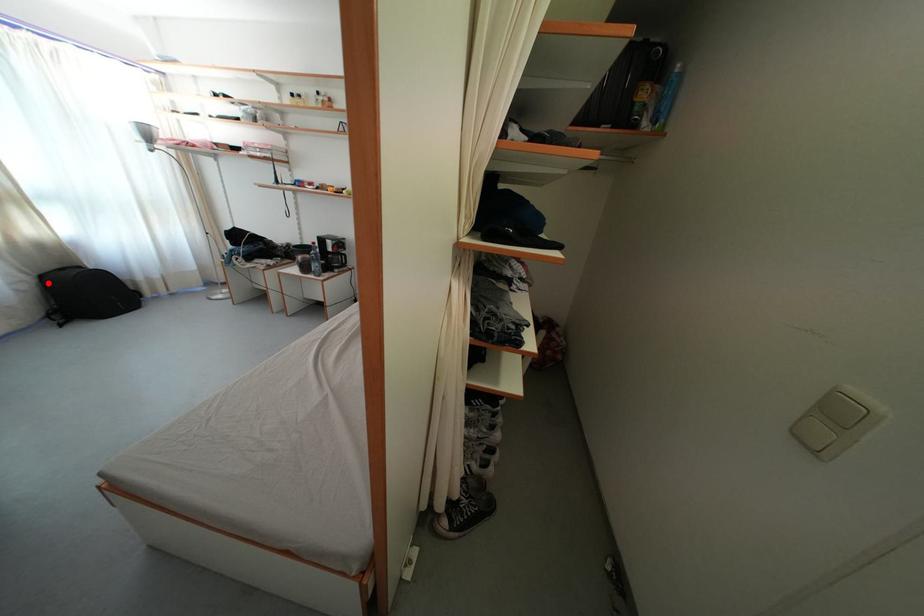
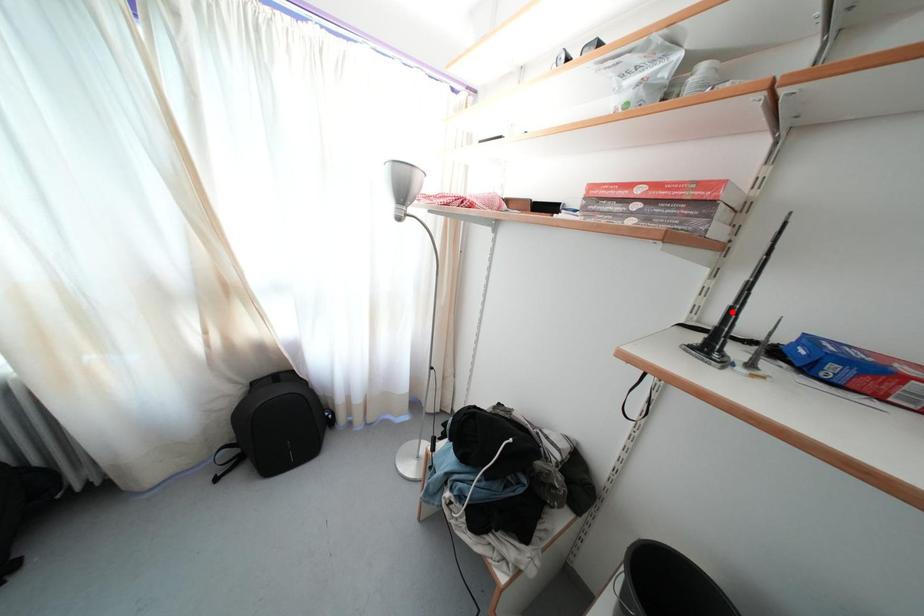
I am providing you with two images of the same scene from different viewpoints. A red point is marked on the first image and another point is marked on the second image. Are the points marked in image1 and image2 representing the same 3D position?

No